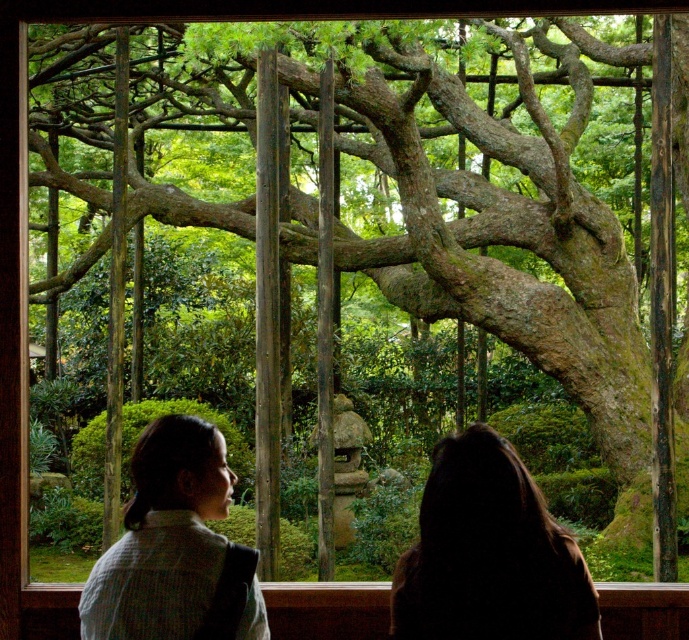
Question: Among these points, which one is nearest to the camera?

Choices:
 (A) (495, 620)
 (B) (209, 502)

Answer: (A)

Question: Considering the relative positions of dark brown hair at upper center and white textured sweater at lower left in the image provided, where is dark brown hair at upper center located with respect to white textured sweater at lower left?

Choices:
 (A) right
 (B) left

Answer: (A)

Question: Which object is closer to the camera taking this photo?

Choices:
 (A) white textured sweater at lower left
 (B) dark brown hair at upper center

Answer: (B)

Question: Which of the following is the closest to the observer?

Choices:
 (A) (508, 532)
 (B) (205, 618)

Answer: (A)

Question: Is dark brown hair at upper center to the left of white textured sweater at lower left from the viewer's perspective?

Choices:
 (A) yes
 (B) no

Answer: (B)

Question: Where is dark brown hair at upper center located in relation to white textured sweater at lower left in the image?

Choices:
 (A) below
 (B) above

Answer: (B)